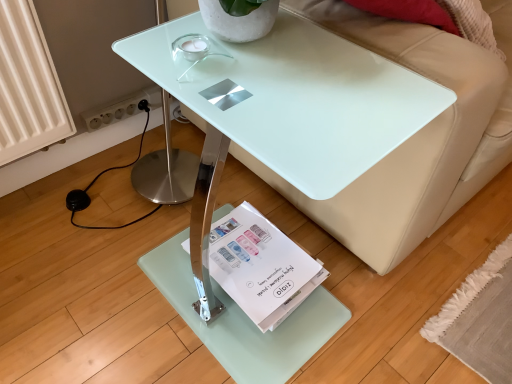
Question: Does point (397, 215) appear closer or farther from the camera than point (237, 236)?

Choices:
 (A) farther
 (B) closer

Answer: (B)

Question: From their relative heights in the image, would you say beige leather couch at upper right is taller or shorter than white paper magazine at lower center?

Choices:
 (A) short
 (B) tall

Answer: (B)

Question: Based on their relative distances, which object is farther from the transparent glass table at center?

Choices:
 (A) white paper magazine at lower center
 (B) beige leather couch at upper right

Answer: (A)

Question: Based on their relative distances, which object is farther from the white paper magazine at lower center?

Choices:
 (A) transparent glass table at center
 (B) beige leather couch at upper right

Answer: (B)